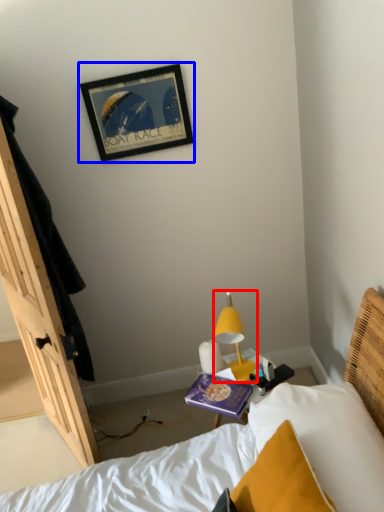
Question: Which of the following is the closest to the observer, lamp (highlighted by a red box) or picture frame (highlighted by a blue box)?

Choices:
 (A) lamp
 (B) picture frame

Answer: (A)